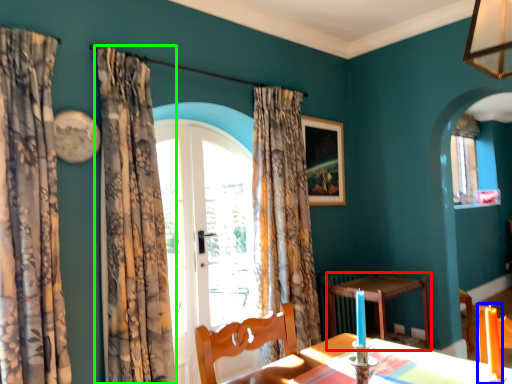
Question: Which is farther away from table (highlighted by a red box)? candle (highlighted by a blue box) or curtain (highlighted by a green box)?

Choices:
 (A) candle
 (B) curtain

Answer: (A)